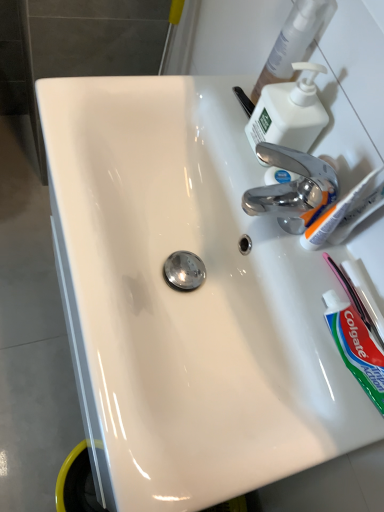
Locate an element on the screen. vacant area that is in front of pink plastic toothbrush at lower right, which appears as the 2th toothbrush when viewed from the left is located at coordinates (326, 391).